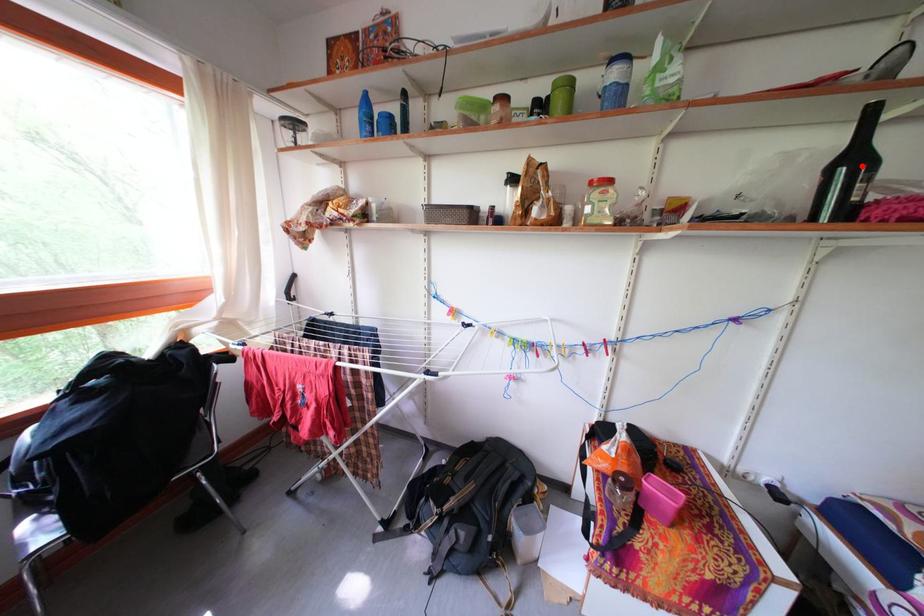
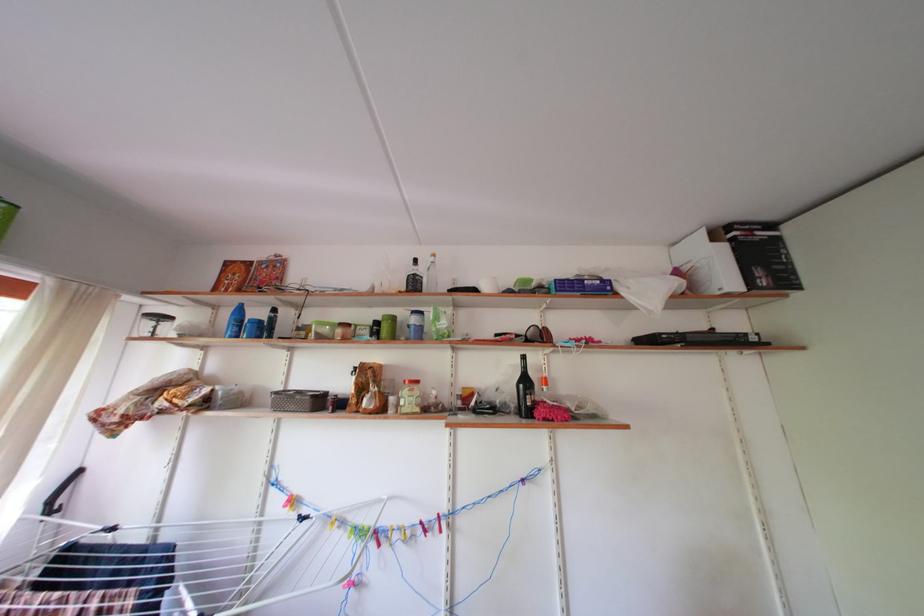
Locate, in the second image, the point that corresponds to the highlighted location in the first image.

(533, 387)